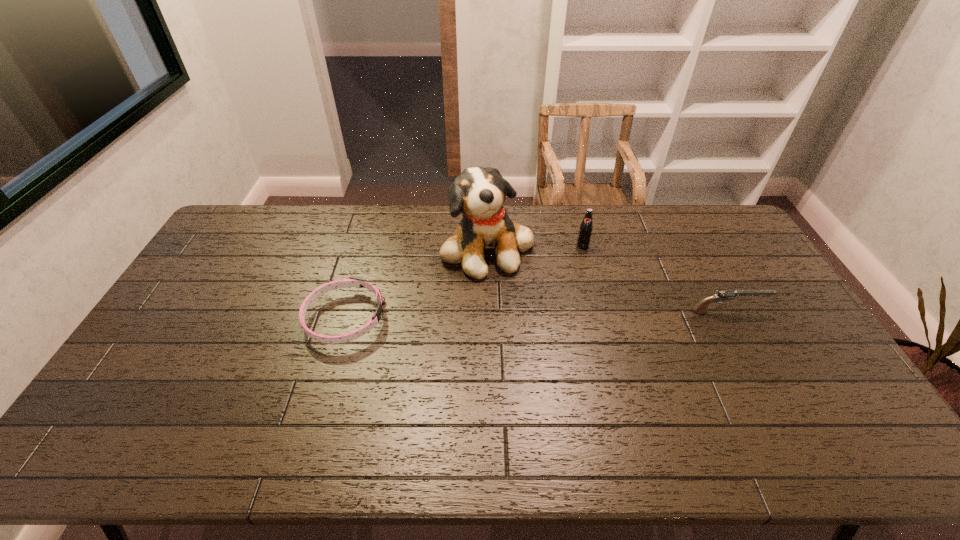
Find the location of a particular element. The image size is (960, 540). vacant spot on the desktop that is between the shortest object and the gun and is positioned on the front label of the second object from right to left is located at coordinates (579, 314).

Identify the location of free space on the desktop that is between the shortest object and the gun and is positioned at the face of the third object from right to left. Image resolution: width=960 pixels, height=540 pixels. (545, 314).